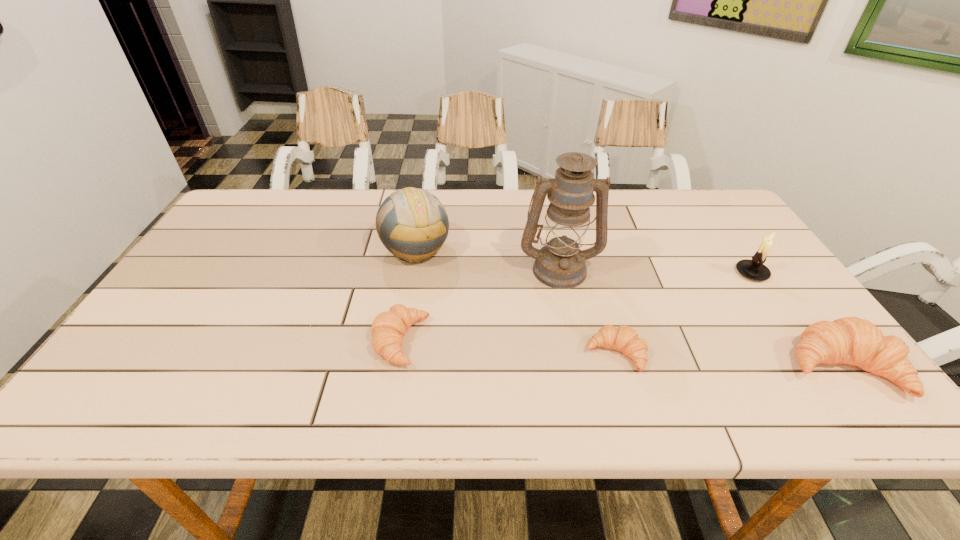
You are a GUI agent. You are given a task and a screenshot of the screen. Output one action in this format:
    pyautogui.click(x=<x>, y=<y>)
    Task: Click on the leftmost crescent roll
    The image size is (960, 540).
    Given the screenshot: What is the action you would take?
    pyautogui.click(x=388, y=328)

Locate an element on the screen. The width and height of the screenshot is (960, 540). the second shortest object is located at coordinates (388, 328).

Find the location of a particular element. This screenshot has height=540, width=960. the shortest object is located at coordinates pyautogui.click(x=624, y=339).

Where is `the second crescent roll from right to left`? the second crescent roll from right to left is located at coordinates (624, 339).

Locate an element on the screen. The width and height of the screenshot is (960, 540). the tallest crescent roll is located at coordinates (850, 340).

Where is `the fourth tallest object`? The image size is (960, 540). the fourth tallest object is located at coordinates (850, 340).

This screenshot has height=540, width=960. I want to click on the fourth shortest object, so click(x=754, y=269).

This screenshot has width=960, height=540. I want to click on volleyball, so click(412, 224).

Where is `oil lamp`? The height and width of the screenshot is (540, 960). oil lamp is located at coordinates (560, 264).

Where is `free space located on the right of the second tallest crescent roll`? free space located on the right of the second tallest crescent roll is located at coordinates (599, 341).